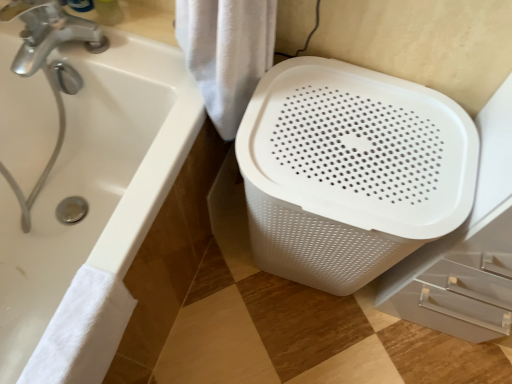
Question: From the image's perspective, relative to white fluffy towel at lower left, the second bath towel in the right-to-left sequence, is white glossy bathtub at lower left above or below?

Choices:
 (A) above
 (B) below

Answer: (A)

Question: Looking at their shapes, would you say white glossy bathtub at lower left is wider or thinner than white fluffy towel at lower left, placed as the 1th bath towel when sorted from left to right?

Choices:
 (A) thin
 (B) wide

Answer: (B)

Question: Which object is the farthest from the white glossy bathtub at lower left?

Choices:
 (A) white fabric towel at center, the 2th bath towel positioned from the left
 (B) white fluffy towel at lower left, the 1th bath towel ordered from the bottom

Answer: (A)

Question: Estimate the real-world distances between objects in this image. Which object is closer to the white fluffy towel at lower left, the 1th bath towel ordered from the bottom?

Choices:
 (A) white glossy bathtub at lower left
 (B) white fabric towel at center, arranged as the 1th bath towel when viewed from the top

Answer: (A)